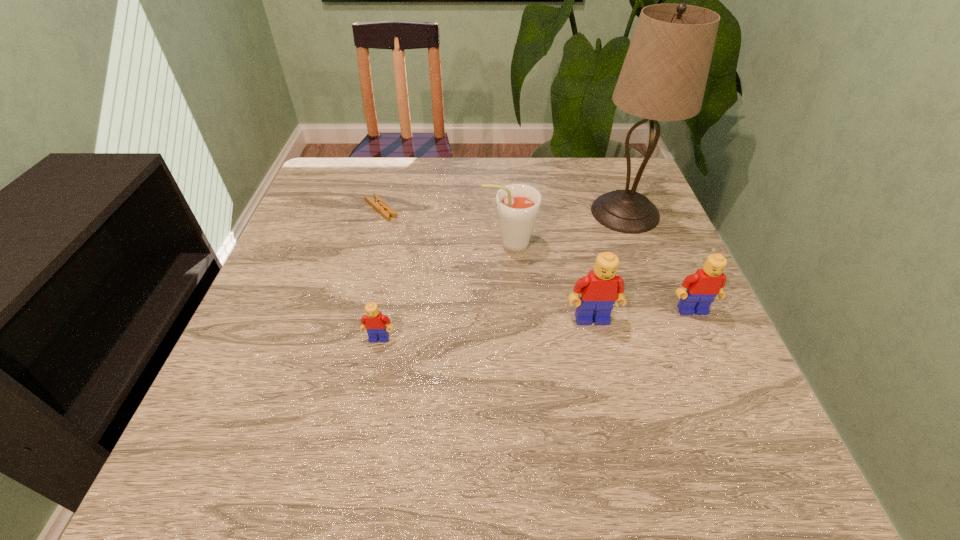
This screenshot has width=960, height=540. I want to click on vacant region located 0.230m on the face of the second shortest Lego, so click(x=743, y=423).

The width and height of the screenshot is (960, 540). What are the coordinates of `vacant space positioned on the drink side of the fourth object from right to left` in the screenshot? It's located at (402, 245).

At what (x,y) coordinates should I click in order to perform the action: click on vacant position located 0.280m on the drink side of the fourth object from right to left. Please return your answer as a coordinate pair (x, y). The image size is (960, 540). Looking at the image, I should click on (364, 245).

Locate an element on the screen. vacant space situated 0.250m on the drink side of the fourth object from right to left is located at coordinates (376, 245).

The height and width of the screenshot is (540, 960). Identify the location of vacant space located 0.330m on the front-facing side of the lampshade. (463, 213).

Find the location of a particular element. This screenshot has width=960, height=540. vacant area situated on the front-facing side of the lampshade is located at coordinates (513, 213).

Locate an element on the screen. The height and width of the screenshot is (540, 960). vacant region located on the front-facing side of the lampshade is located at coordinates (524, 213).

Find the location of a particular element. The height and width of the screenshot is (540, 960). vacant space located 0.070m on the back of the shortest object is located at coordinates (388, 182).

The height and width of the screenshot is (540, 960). Find the location of `lampshade at the far edge`. lampshade at the far edge is located at coordinates (663, 78).

You are a GUI agent. You are given a task and a screenshot of the screen. Output one action in this format:
    pyautogui.click(x=<x>, y=<y>)
    Task: Click on the clothespin that is at the far edge
    The height and width of the screenshot is (540, 960).
    Given the screenshot: What is the action you would take?
    click(386, 211)